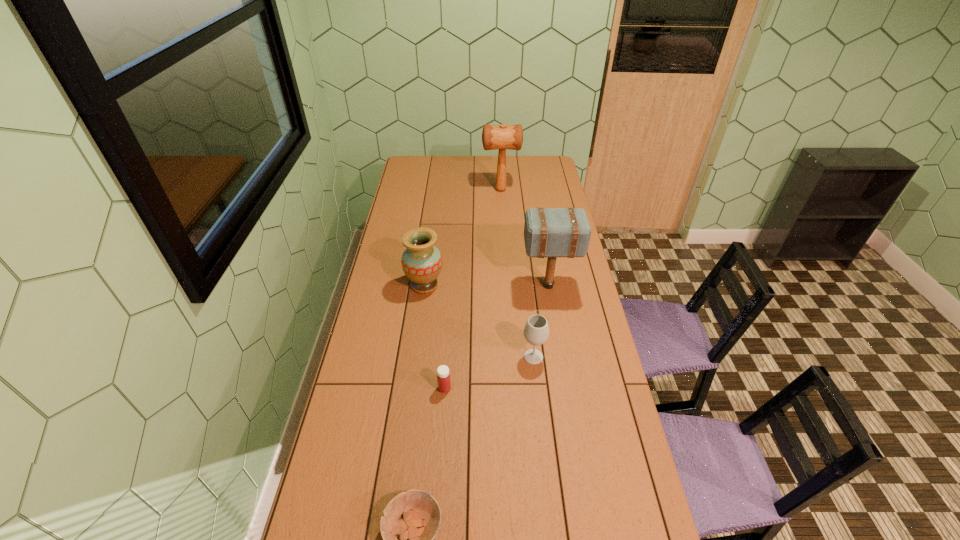
This screenshot has height=540, width=960. I want to click on the farther mallet, so click(x=502, y=137).

Identify the location of the nearer mallet. (548, 232).

The height and width of the screenshot is (540, 960). What are the coordinates of `the third tallest object` in the screenshot? It's located at (421, 262).

Where is `wineglass`? Image resolution: width=960 pixels, height=540 pixels. wineglass is located at coordinates (536, 331).

Locate an element on the screen. the third shortest object is located at coordinates (536, 331).

Locate an element on the screen. the second nearest object is located at coordinates (443, 378).

Where is `the second shortest object`? the second shortest object is located at coordinates (443, 378).

You are a GUI agent. You are given a task and a screenshot of the screen. Output one action in this format:
    pyautogui.click(x=<x>, y=<y>)
    Task: Click on the vacant region located 0.120m on the strike surface of the farthest object
    
    Given the screenshot: What is the action you would take?
    pyautogui.click(x=460, y=190)

The height and width of the screenshot is (540, 960). Identify the location of blank space located on the strike surface of the farthest object. (462, 190).

Image resolution: width=960 pixels, height=540 pixels. What are the coordinates of `vacant area situated 0.320m on the strike surface of the farthest object` in the screenshot? It's located at (423, 190).